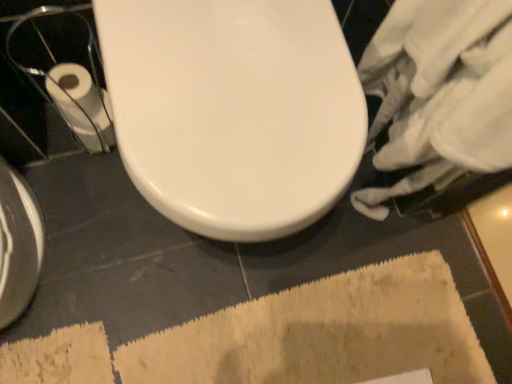
Where is `free point above beige textured bath mat at lower center (from a real-world perspective)`? free point above beige textured bath mat at lower center (from a real-world perspective) is located at coordinates (280, 341).